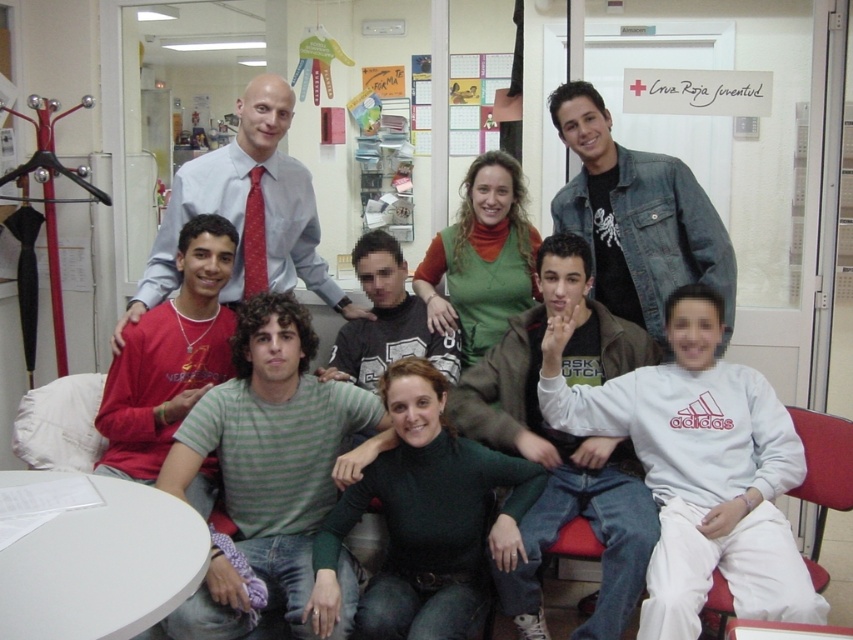
You are a photographer trying to adjust the lighting for a group photo. You notice the dark brown leather jacket at center and the denim jacket at upper center. Which jacket is closer to the camera?

The denim jacket at upper center is closer to the camera because the dark brown leather jacket at center is positioned under it.

You are standing in the room and want to hang your backpack on the red coat rack on the left. The dark brown leather jacket at center is currently occupying the space where you want to hang it. Can you hang your backpack there without moving the jacket?

The dark brown leather jacket at center is located at point (564, 442), so it is positioned at the center of the image. Since the red coat rack is on the left side of the frame, the jacket is not blocking access to the coat rack. Therefore, you can hang your backpack on the red coat rack on the left without moving the jacket.